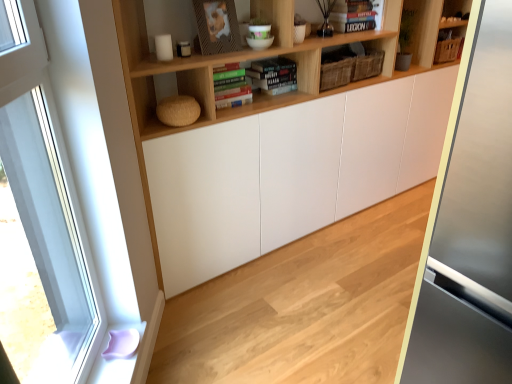
Question: Should I look upward or downward to see hardcover book at center, which appears as the 1th book when viewed from the left?

Choices:
 (A) down
 (B) up

Answer: (B)

Question: Is natural wood floor at center shorter than clear glass window at left?

Choices:
 (A) no
 (B) yes

Answer: (B)

Question: Is clear glass window at left a part of natural wood floor at center?

Choices:
 (A) yes
 (B) no

Answer: (B)

Question: Does natural wood floor at center have a smaller size compared to clear glass window at left?

Choices:
 (A) yes
 (B) no

Answer: (B)

Question: Considering the relative positions of natural wood floor at center and clear glass window at left in the image provided, is natural wood floor at center to the left of clear glass window at left from the viewer's perspective?

Choices:
 (A) yes
 (B) no

Answer: (B)

Question: From a real-world perspective, is natural wood floor at center over clear glass window at left?

Choices:
 (A) yes
 (B) no

Answer: (B)

Question: Does natural wood floor at center have a greater width compared to clear glass window at left?

Choices:
 (A) no
 (B) yes

Answer: (B)

Question: Is hardcover book at upper center, arranged as the 2th book when viewed from the left, wider than wooden shelf at upper center?

Choices:
 (A) yes
 (B) no

Answer: (B)

Question: From a real-world perspective, does hardcover book at upper center, arranged as the 2th book when viewed from the left, sit lower than wooden shelf at upper center?

Choices:
 (A) no
 (B) yes

Answer: (A)

Question: Can you confirm if hardcover book at upper center, marked as the 2th book in a front-to-back arrangement, is shorter than wooden shelf at upper center?

Choices:
 (A) yes
 (B) no

Answer: (A)

Question: Can you confirm if hardcover book at upper center, the second book from the bottom, is smaller than wooden shelf at upper center?

Choices:
 (A) no
 (B) yes

Answer: (B)

Question: Can we say hardcover book at upper center, which is the 1th book from top to bottom, lies outside wooden shelf at upper center?

Choices:
 (A) yes
 (B) no

Answer: (B)

Question: Does hardcover book at upper center, marked as the first book in a back-to-front arrangement, have a greater height compared to clear glass window at left?

Choices:
 (A) no
 (B) yes

Answer: (A)